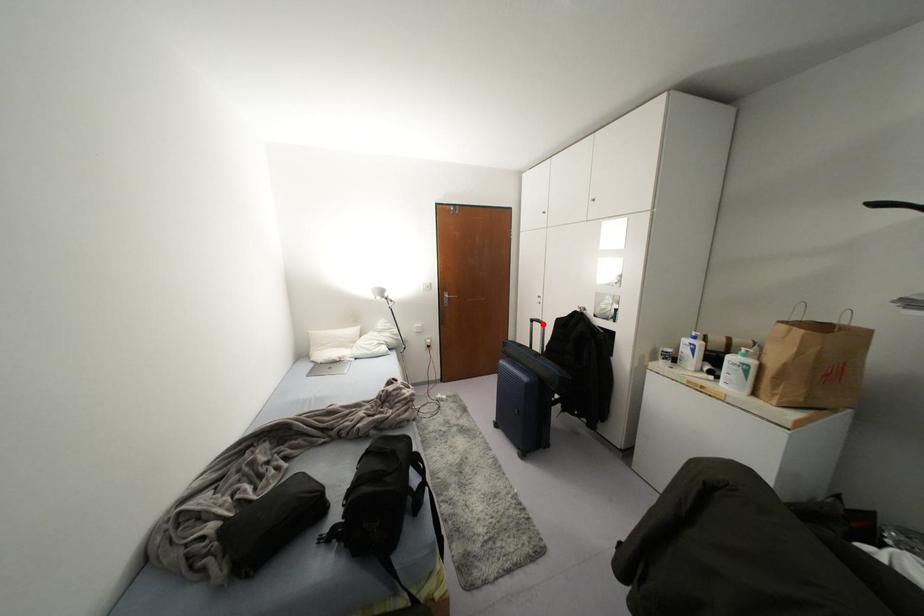
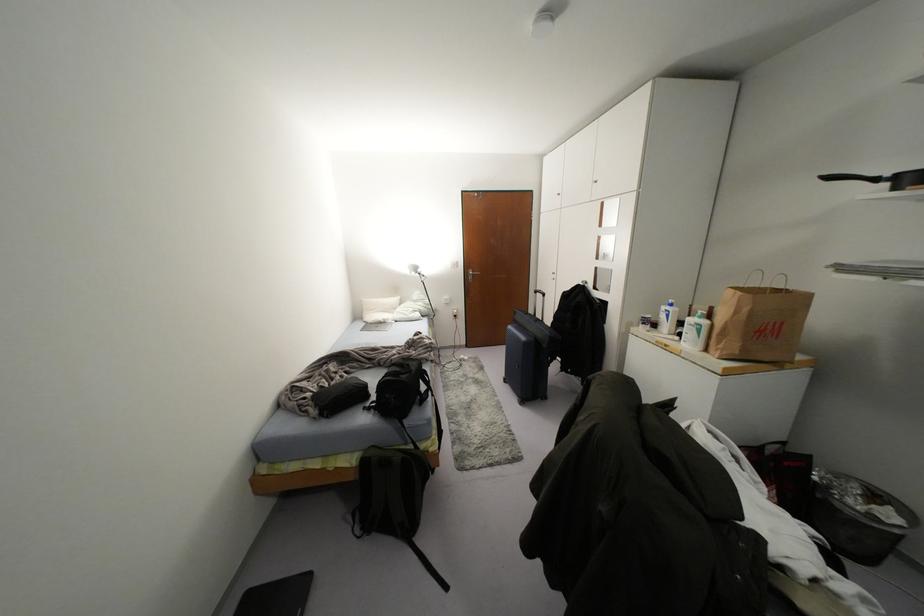
Where in the second image is the point corresponding to the highlighted location from the first image?

(542, 294)